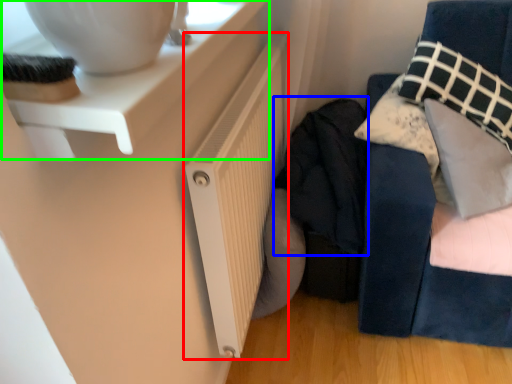
Question: Based on their relative distances, which object is nearer to radiator (highlighted by a red box)? Choose from clothing (highlighted by a blue box) and table (highlighted by a green box).

Choices:
 (A) clothing
 (B) table

Answer: (A)